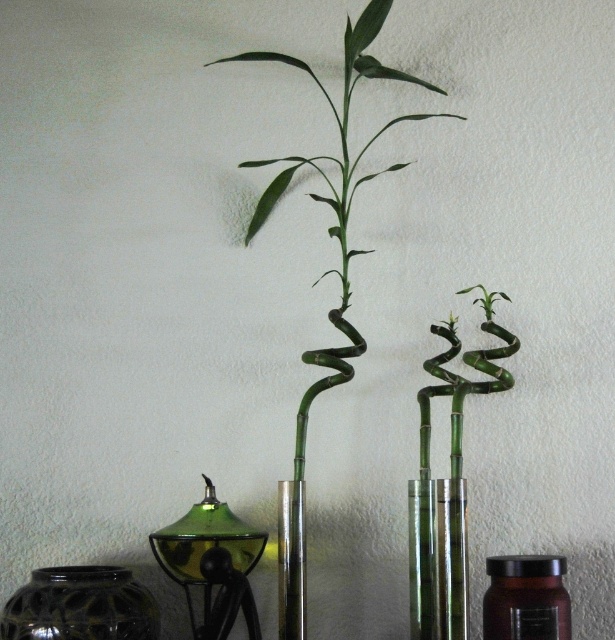
Does point (89, 577) come farther from viewer compared to point (541, 579)?

No, (89, 577) is closer to viewer.

Does black glossy jar at lower left have a larger size compared to translucent amber jar at center?

Indeed, black glossy jar at lower left has a larger size compared to translucent amber jar at center.

Image resolution: width=615 pixels, height=640 pixels. Identify the location of black glossy jar at lower left. (81, 605).

Is green bamboo at center bigger than translucent amber jar at center?

Indeed, green bamboo at center has a larger size compared to translucent amber jar at center.

Is point (304, 532) less distant than point (547, 604)?

No.

Find the location of a particular element. The image size is (615, 640). green bamboo at center is located at coordinates (327, 269).

Is green bamboo at center bigger than black glossy jar at lower left?

Correct, green bamboo at center is larger in size than black glossy jar at lower left.

Does green bamboo at center have a greater width compared to black glossy jar at lower left?

Yes, green bamboo at center is wider than black glossy jar at lower left.

Identify the location of green bamboo at center. (327, 269).

Find the location of a particular element. green bamboo at center is located at coordinates (327, 269).